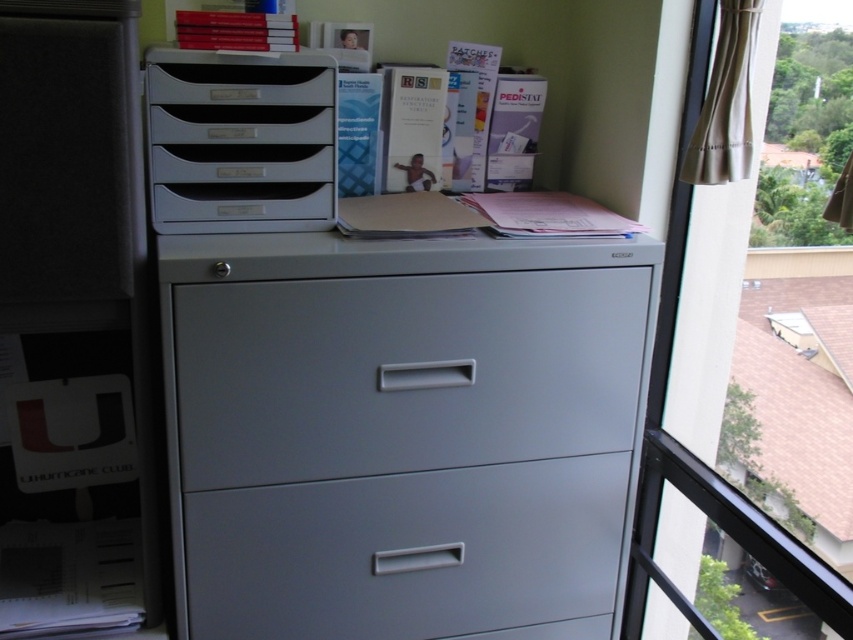
Looking at this image, you are standing in the office and want to reach the point marked as point (x=712, y=355). If your arm can reach up to 1.4 meters, can you reach that point without moving your feet?

The distance between you and point (x=712, y=355) is 1.50 meters, which is beyond your arm reach of 1.4 meters. Therefore, you cannot reach the point without moving your feet.

You are organizing the office and need to place a new item between the satin gray drawer at center and the matte plastic file cabinet at upper left. Which object should be placed closer to the left side to maintain alignment with the existing furniture?

The matte plastic file cabinet at upper left should be placed closer to the left side because its width is smaller than the satin gray drawer at center, allowing for proper alignment.